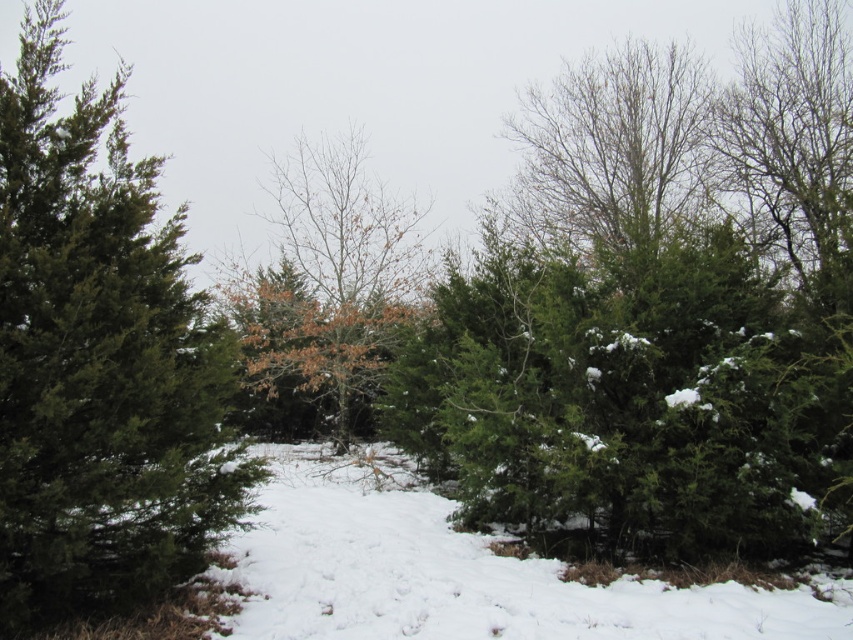
Question: Which point is closer to the camera?

Choices:
 (A) bare branches at center
 (B) white fluffy snow at center
 (C) green matte evergreen tree at left

Answer: (C)

Question: Is green matte evergreen tree at left closer to camera compared to white fluffy snow at center?

Choices:
 (A) no
 (B) yes

Answer: (B)

Question: Is white fluffy snow at center closer to camera compared to bare branches at center?

Choices:
 (A) yes
 (B) no

Answer: (A)

Question: In this image, where is green matte evergreen tree at left located relative to white fluffy snow at center?

Choices:
 (A) left
 (B) right

Answer: (A)

Question: Among these objects, which one is farthest from the camera?

Choices:
 (A) green matte evergreen tree at left
 (B) white fluffy snow at center
 (C) bare branches at center

Answer: (C)

Question: Which is nearer to the green matte evergreen tree at left?

Choices:
 (A) white fluffy snow at center
 (B) bare branches at center

Answer: (A)